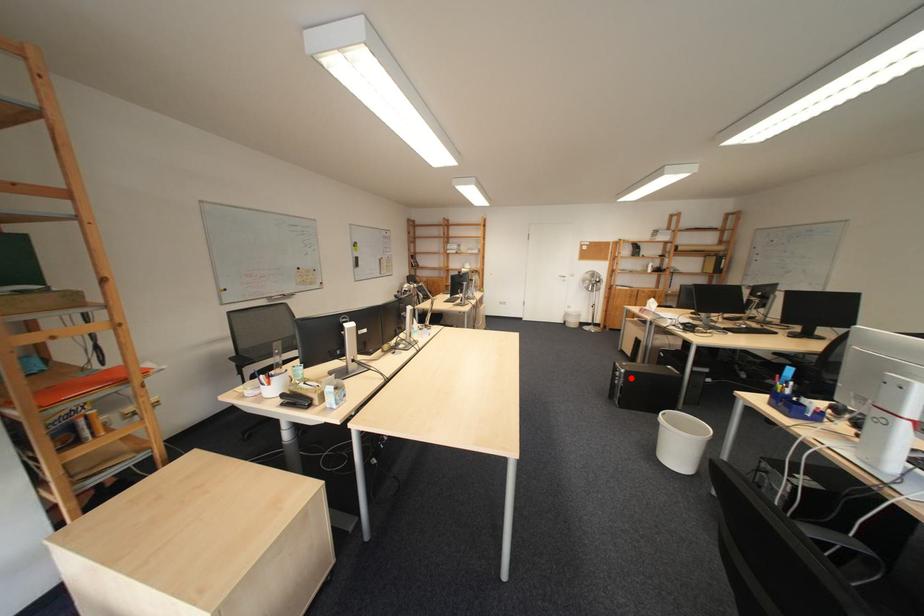
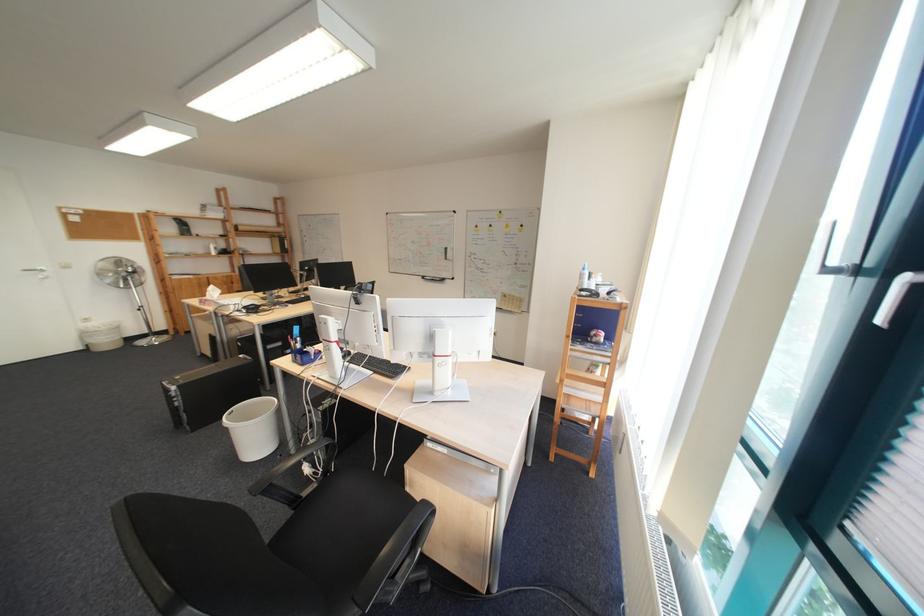
The point at the highlighted location is marked in the first image. Where is the corresponding point in the second image?

(188, 399)